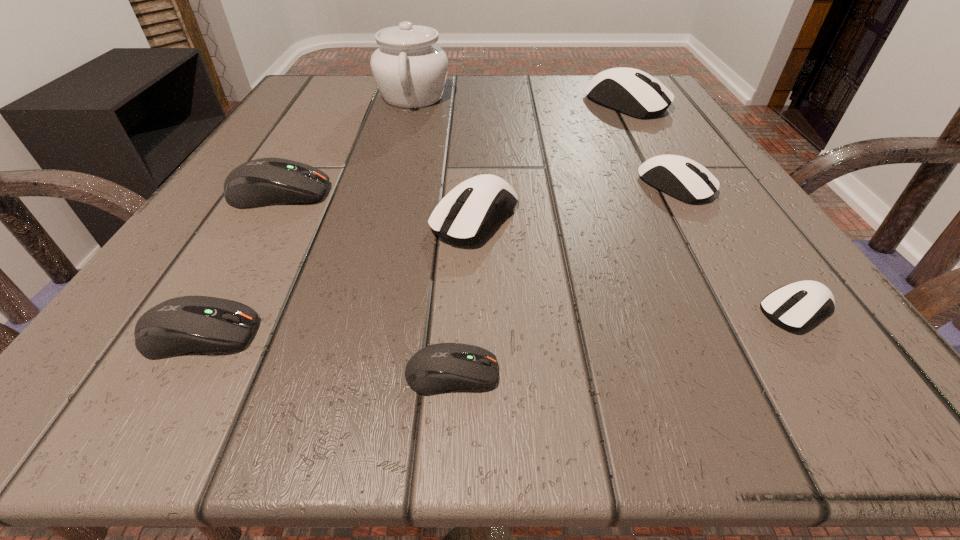
You are a GUI agent. You are given a task and a screenshot of the screen. Output one action in this format:
    pyautogui.click(x=<x>, y=<y>)
    Task: Click on the chinaware
    
    Given the screenshot: What is the action you would take?
    pyautogui.click(x=410, y=70)

Locate an element on the screen. This screenshot has height=540, width=960. white chinaware is located at coordinates (410, 70).

Identify the location of the farthest computer equipment. (633, 92).

Image resolution: width=960 pixels, height=540 pixels. I want to click on the second tallest object, so click(633, 92).

Where is `the leftmost white mouse`? This screenshot has width=960, height=540. the leftmost white mouse is located at coordinates (464, 216).

At what (x,y) coordinates should I click in order to perform the action: click on the biggest dark computer equipment. Please return your answer as a coordinate pair (x, y). The width and height of the screenshot is (960, 540). Looking at the image, I should click on (262, 182).

In order to click on the second smallest white mouse in this screenshot , I will do click(x=682, y=178).

You are a GUI agent. You are given a task and a screenshot of the screen. Output one action in this format:
    pyautogui.click(x=<x>, y=<y>)
    Task: Click on the second smallest dark computer equipment
    
    Given the screenshot: What is the action you would take?
    pyautogui.click(x=188, y=324)

At what (x,y) coordinates should I click in order to perform the action: click on the smallest white mouse. Please return your answer as a coordinate pair (x, y). Image resolution: width=960 pixels, height=540 pixels. Looking at the image, I should click on (790, 306).

At what (x,y) coordinates should I click in order to perform the action: click on the smallest dark computer equipment. Please return your answer as a coordinate pair (x, y). Looking at the image, I should click on [443, 367].